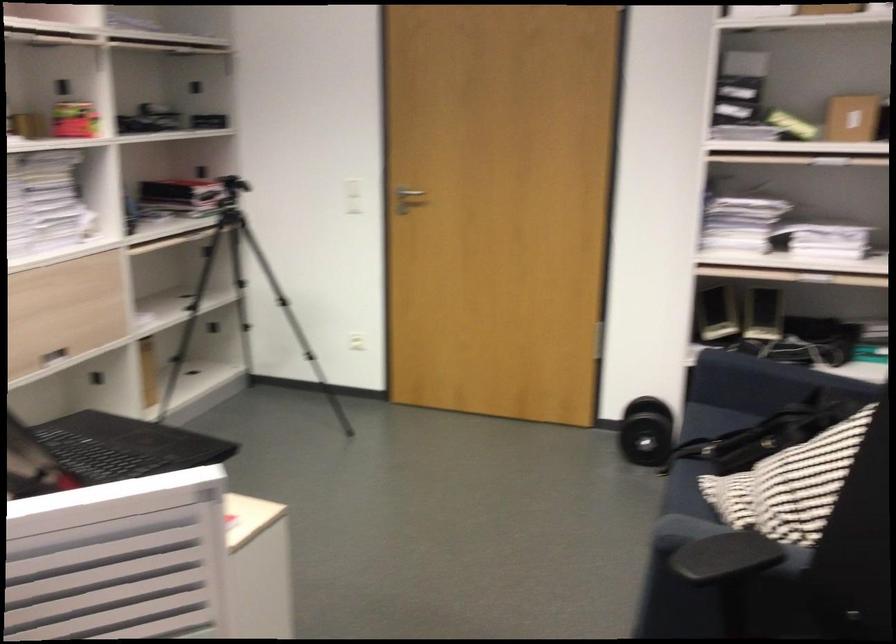
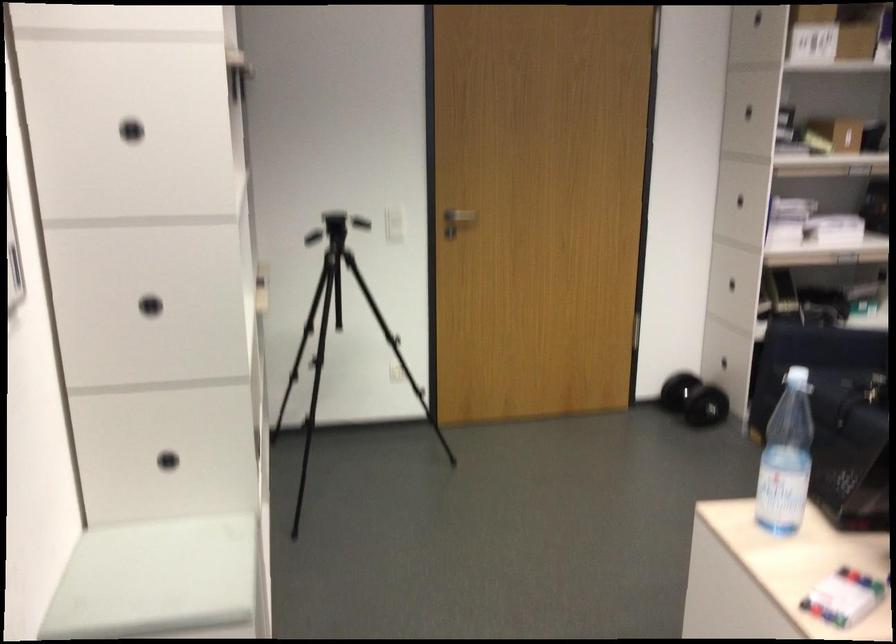
Where in the second image is the point corresponding to pixel 380 187 from the first image?

(393, 214)